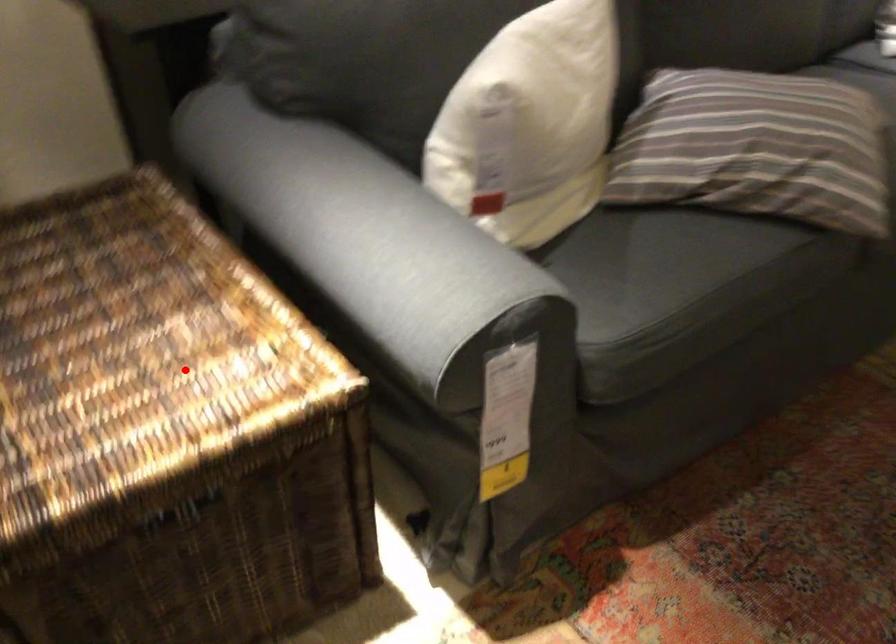
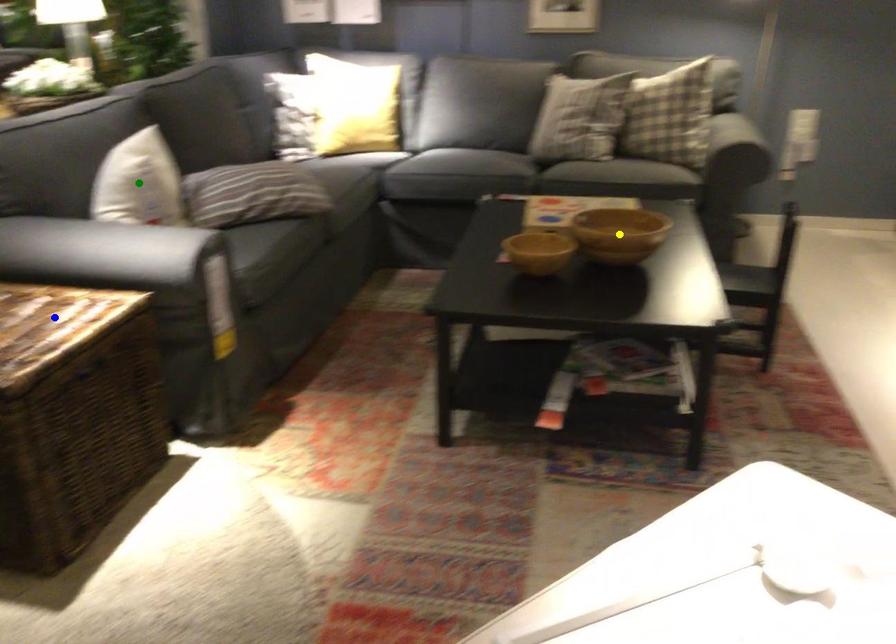
Question: I am providing you with two images of the same scene from different viewpoints. A red point is marked on the first image. You are given multiple points on the second image. Which mark in image 2 goes with the point in image 1?

Choices:
 (A) green point
 (B) yellow point
 (C) blue point

Answer: (C)